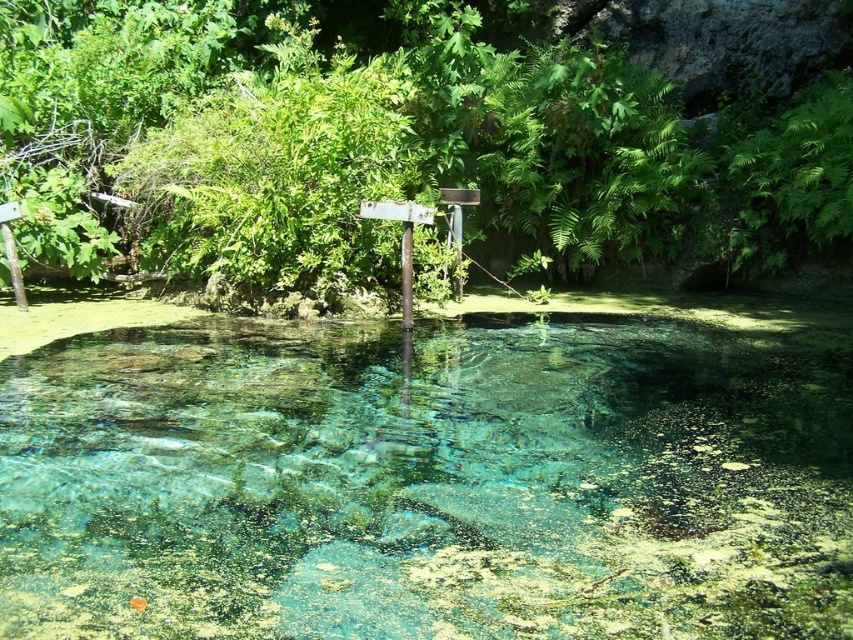
You are standing at the point labeled point (419,132) in the image. What can you see directly in front of you?

You can see a green leafy tree at center directly in front of you at point (419,132).

You are standing at the edge of the water and see two points marked in the image. Which point is closer to you, point (132, 184) or point (410, 228)?

Point (132, 184) is further to the camera than point (410, 228), so the closer point to you is point (410, 228).